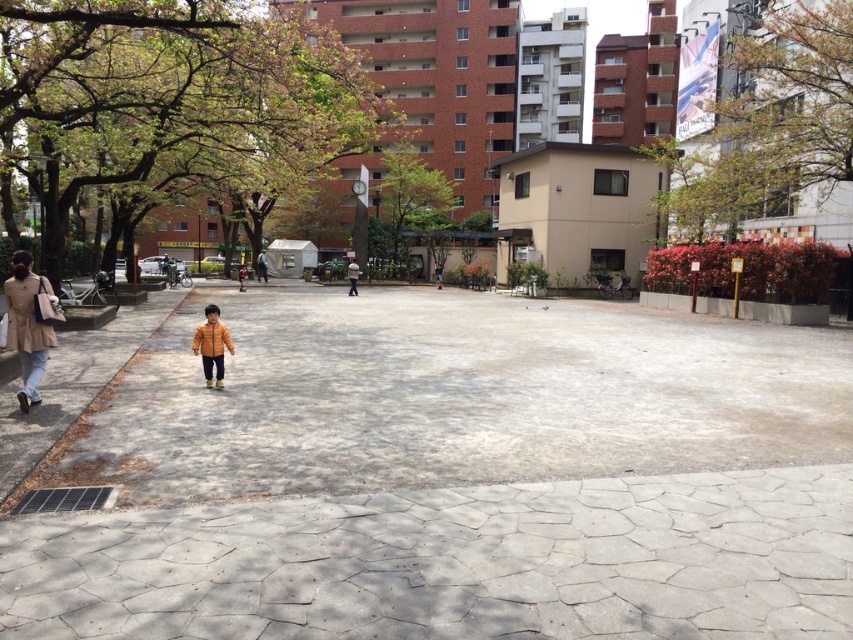
Question: Estimate the real-world distances between objects in this image. Which object is farther from the gray concrete pavement at center?

Choices:
 (A) beige fabric coat at left
 (B) yellow matte jacket at center

Answer: (A)

Question: Which point appears closest to the camera in this image?

Choices:
 (A) (35, 326)
 (B) (299, 321)
 (C) (204, 364)

Answer: (A)

Question: Is gray concrete pavement at center to the right of yellow matte jacket at center from the viewer's perspective?

Choices:
 (A) yes
 (B) no

Answer: (A)

Question: Does gray concrete pavement at center appear on the left side of beige fabric coat at left?

Choices:
 (A) no
 (B) yes

Answer: (A)

Question: Does gray concrete pavement at center have a greater width compared to beige fabric coat at left?

Choices:
 (A) no
 (B) yes

Answer: (B)

Question: Which point is closer to the camera taking this photo?

Choices:
 (A) pyautogui.click(x=675, y=321)
 (B) pyautogui.click(x=9, y=314)
 (C) pyautogui.click(x=215, y=336)

Answer: (B)